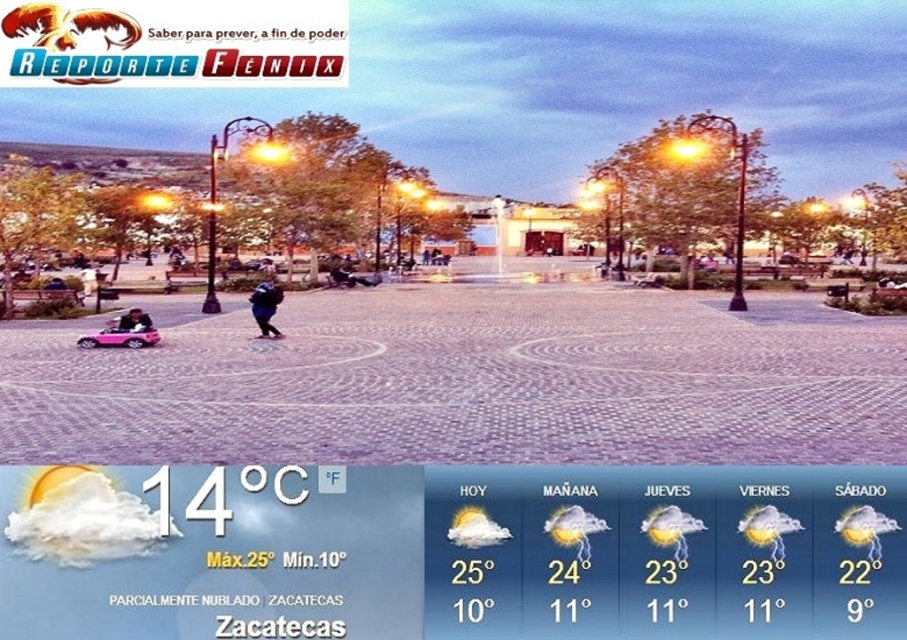
You are a photographer setting up a tripod in the plaza. You need to ensure there is enough space between the dark blue fabric jacket at center and the matte pink car at lower left to avoid blocking the view of either object. Based on their sizes, which object requires more space horizontally?

The dark blue fabric jacket at center requires more horizontal space because its width surpasses that of the matte pink car at lower left.